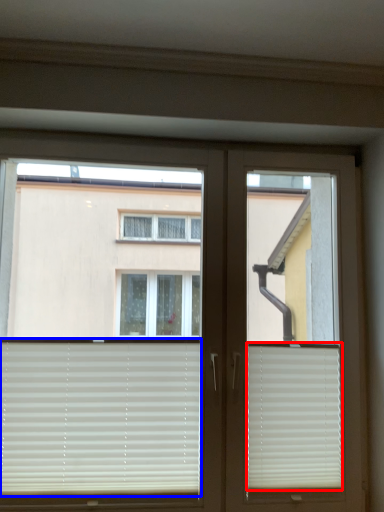
Question: Among these objects, which one is nearest to the camera, window blind (highlighted by a red box) or window blind (highlighted by a blue box)?

Choices:
 (A) window blind
 (B) window blind

Answer: (B)